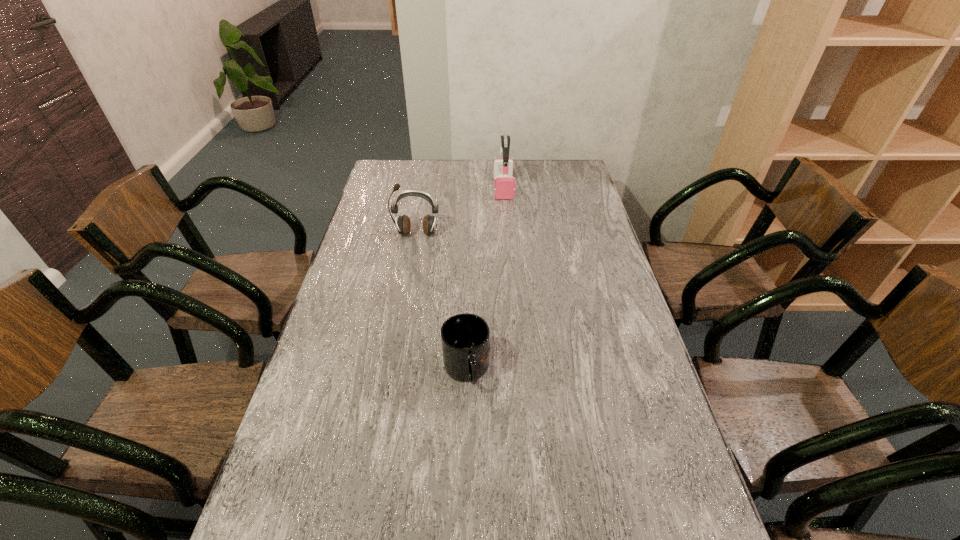
Where is `free space between the leftmost object and the shortest object`? free space between the leftmost object and the shortest object is located at coordinates [442, 302].

In order to click on vacant region between the right earphone and the shortest object in this screenshot , I will do `click(485, 279)`.

Where is `free space between the leftmost object and the rightmost object`? This screenshot has width=960, height=540. free space between the leftmost object and the rightmost object is located at coordinates (460, 211).

Identify the location of vacant area between the nearest object and the right earphone. (485, 279).

Identify which object is the closest to the rightmost object. Please provide its 2D coordinates. Your answer should be formatted as a tuple, i.e. [(x, y)], where the tuple contains the x and y coordinates of a point satisfying the conditions above.

[(403, 223)]

The height and width of the screenshot is (540, 960). Identify the location of the second closest object to the leftmost object. (465, 338).